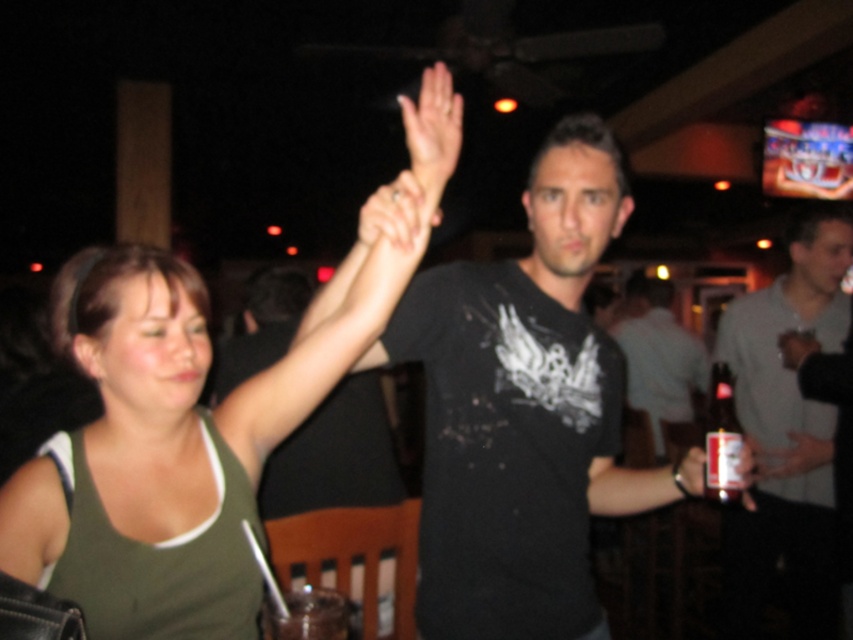
Question: Does dark gray t-shirt at center appear over translucent glass cup at lower center?

Choices:
 (A) yes
 (B) no

Answer: (A)

Question: Which object is the closest to the gray cotton shirt at right?

Choices:
 (A) clear glass bottle at right
 (B) translucent glass cup at lower center
 (C) dark gray t-shirt at center
 (D) green fabric tank top at upper left

Answer: (A)

Question: Which point is farther to the camera?

Choices:
 (A) coord(711,442)
 (B) coord(170,586)
 (C) coord(680,362)

Answer: (C)

Question: Does gray cotton shirt at right have a lesser width compared to translucent glass cup at lower center?

Choices:
 (A) yes
 (B) no

Answer: (B)

Question: Considering the real-world distances, which object is closest to the gray cotton shirt at right?

Choices:
 (A) translucent glass cup at lower center
 (B) clear glass bottle at right
 (C) dark gray t-shirt at center

Answer: (B)

Question: Can you confirm if green fabric tank top at upper left is positioned to the right of gray cotton shirt at right?

Choices:
 (A) no
 (B) yes

Answer: (A)